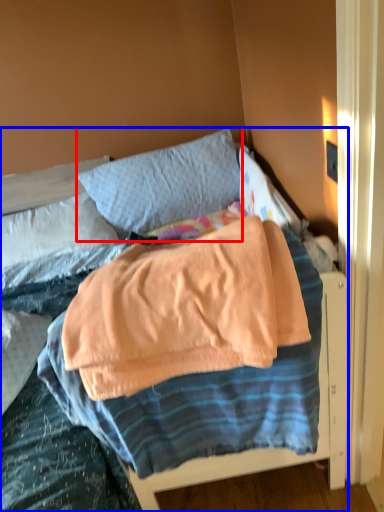
Question: Which point is closer to the camera, pillow (highlighted by a red box) or bed (highlighted by a blue box)?

Choices:
 (A) pillow
 (B) bed

Answer: (B)